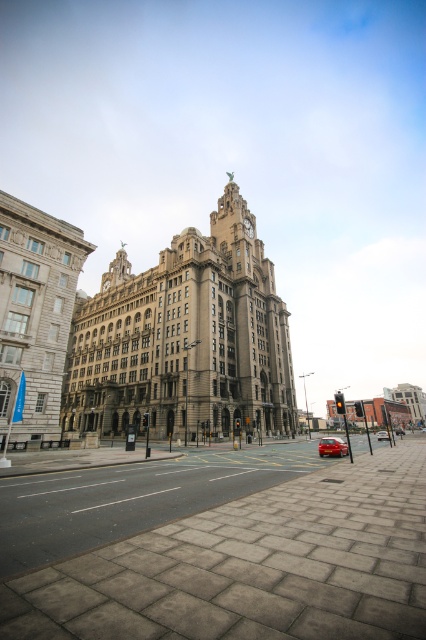
Looking at this image, which is below, metallic red car at center or shiny red sedan at center?

shiny red sedan at center is below.

I want to click on metallic red car at center, so click(382, 435).

Describe the element at coordinates (333, 445) in the screenshot. I see `shiny red car at center` at that location.

Looking at this image, does shiny red car at center appear over metallic red car at center?

Correct, shiny red car at center is located above metallic red car at center.

What do you see at coordinates (333, 445) in the screenshot?
I see `shiny red car at center` at bounding box center [333, 445].

Identify the location of shiny red car at center. The height and width of the screenshot is (640, 426). (333, 445).

Who is positioned more to the right, shiny red car at center or shiny red sedan at center?

shiny red sedan at center is more to the right.

Does shiny red car at center appear under shiny red sedan at center?

No, shiny red car at center is not below shiny red sedan at center.

Does point (324, 451) come behind point (402, 429)?

No, it is in front of (402, 429).

At what (x,y) coordinates should I click in order to perform the action: click on shiny red car at center. Please return your answer as a coordinate pair (x, y). Looking at the image, I should click on (333, 445).